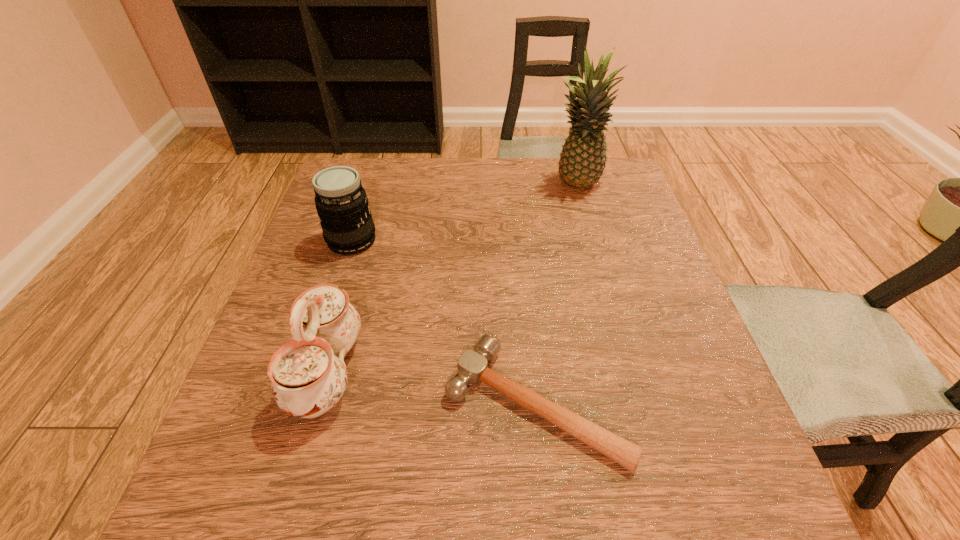
This screenshot has height=540, width=960. Identify the location of object at the near edge. (472, 368).

The width and height of the screenshot is (960, 540). In order to click on telephoto lens positioned at the left edge in this screenshot , I will do `click(341, 202)`.

Find the location of a particular element. Image resolution: width=960 pixels, height=540 pixels. chinaware that is at the left edge is located at coordinates (308, 379).

The height and width of the screenshot is (540, 960). Find the location of `object positioned at the right edge`. object positioned at the right edge is located at coordinates 582,161.

Where is `object that is positioned at the far right corner`? The width and height of the screenshot is (960, 540). object that is positioned at the far right corner is located at coordinates (582, 161).

Where is `vacant space at the far edge`? This screenshot has width=960, height=540. vacant space at the far edge is located at coordinates (465, 164).

Locate an element on the screen. vacant space at the near edge is located at coordinates (518, 490).

In the image, there is a desktop. Identify the location of free region at the left edge. The image size is (960, 540). (304, 264).

The width and height of the screenshot is (960, 540). In the image, there is a desktop. Find the location of `vacant space at the right edge`. vacant space at the right edge is located at coordinates coord(610,264).

The height and width of the screenshot is (540, 960). I want to click on vacant space at the far left corner, so click(362, 176).